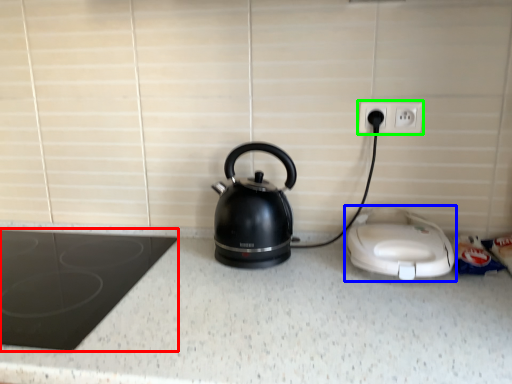
Question: Which object is positioned farthest from home appliance (highlighted by a red box)? Select from home appliance (highlighted by a blue box) and electric outlet (highlighted by a green box).

Choices:
 (A) home appliance
 (B) electric outlet

Answer: (B)